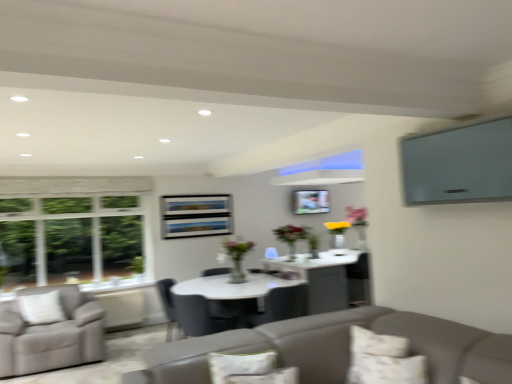
Question: Does matte gray chair at center, which is counted as the second chair, starting from the left, have a greater height compared to white textured pillow at lower right, the 2th pillow viewed from the left?

Choices:
 (A) yes
 (B) no

Answer: (A)

Question: Can you confirm if matte gray chair at center, which ranks as the 1th chair in right-to-left order, is bigger than white textured pillow at lower right, which is the 1th pillow from right to left?

Choices:
 (A) yes
 (B) no

Answer: (A)

Question: Is matte gray chair at center, which ranks as the 1th chair in right-to-left order, not near white textured pillow at lower right, which is the 1th pillow from right to left?

Choices:
 (A) no
 (B) yes

Answer: (B)

Question: Does matte gray chair at center, which is counted as the second chair, starting from the left, touch white textured pillow at lower right, the 2th pillow viewed from the left?

Choices:
 (A) no
 (B) yes

Answer: (A)

Question: Is matte gray chair at center, which ranks as the 1th chair in right-to-left order, outside white textured pillow at lower right, which is the 1th pillow from right to left?

Choices:
 (A) yes
 (B) no

Answer: (A)

Question: Considering the relative sizes of matte gray chair at center, which is counted as the second chair, starting from the left, and white textured pillow at lower right, which is the 1th pillow from right to left, in the image provided, is matte gray chair at center, which is counted as the second chair, starting from the left, thinner than white textured pillow at lower right, which is the 1th pillow from right to left,?

Choices:
 (A) no
 (B) yes

Answer: (A)

Question: Is the depth of white textured pillow at lower right, which is the 1th pillow from right to left, greater than that of matte black chair at center, which is the first chair in left-to-right order?

Choices:
 (A) no
 (B) yes

Answer: (A)

Question: From the image's perspective, does white textured pillow at lower right, the 2th pillow viewed from the left, appear higher than matte black chair at center, which is the first chair in left-to-right order?

Choices:
 (A) no
 (B) yes

Answer: (B)

Question: From a real-world perspective, is white textured pillow at lower right, which is the 1th pillow from right to left, under matte black chair at center, the second chair when ordered from right to left?

Choices:
 (A) no
 (B) yes

Answer: (A)

Question: Does white textured pillow at lower right, which is the 1th pillow from right to left, have a lesser width compared to matte black chair at center, the second chair when ordered from right to left?

Choices:
 (A) no
 (B) yes

Answer: (B)

Question: Does white textured pillow at lower right, which is the 1th pillow from right to left, have a larger size compared to matte black chair at center, which is the first chair in left-to-right order?

Choices:
 (A) no
 (B) yes

Answer: (A)

Question: Are white textured pillow at lower right, the 2th pillow viewed from the left, and matte black chair at center, which is the first chair in left-to-right order, making contact?

Choices:
 (A) yes
 (B) no

Answer: (B)

Question: Is matte gray chair at center, which ranks as the 1th chair in right-to-left order, at the back of matte black chair at center, the second chair when ordered from right to left?

Choices:
 (A) no
 (B) yes

Answer: (A)